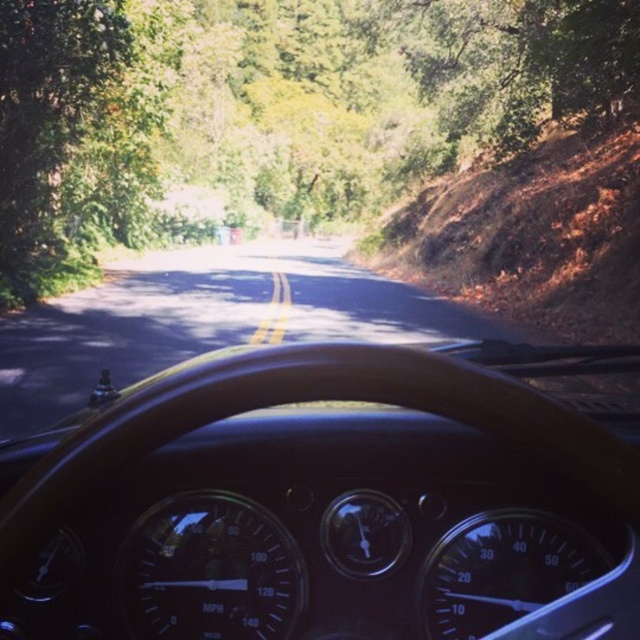
Question: Can you confirm if green leafy tree at center is smaller than asphalt road at center?

Choices:
 (A) yes
 (B) no

Answer: (B)

Question: Among these points, which one is farthest from the camera?

Choices:
 (A) (365, 401)
 (B) (150, 184)

Answer: (B)

Question: Does black leather steering wheel at center appear under asphalt road at center?

Choices:
 (A) yes
 (B) no

Answer: (A)

Question: Does black leather steering wheel at center have a smaller size compared to green leafy tree at center?

Choices:
 (A) yes
 (B) no

Answer: (A)

Question: Which of these objects is positioned closest to the green leafy tree at center?

Choices:
 (A) asphalt road at center
 (B) black leather steering wheel at center

Answer: (A)

Question: Which point is farther to the camera?

Choices:
 (A) black leather steering wheel at center
 (B) asphalt road at center

Answer: (B)